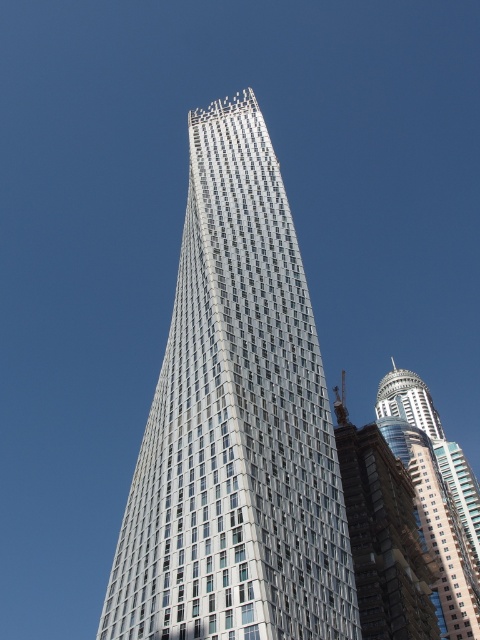
You are an architect evaluating the structural integrity of the buildings in the scene. Considering the metallic glass tower at center and the shiny glass skyscraper at right, which one might require a different foundation design due to its structural characteristics?

The metallic glass tower at center is thinner than the shiny glass skyscraper at right, so it might require a different foundation design to support its structural characteristics.

You are standing at the base of the metallic glass tower at center. Looking up, you notice a point marked at coordinates [236,424]. Where is this point located on the tower?

The point at coordinates [236,424] is located on the metallic glass tower at center.